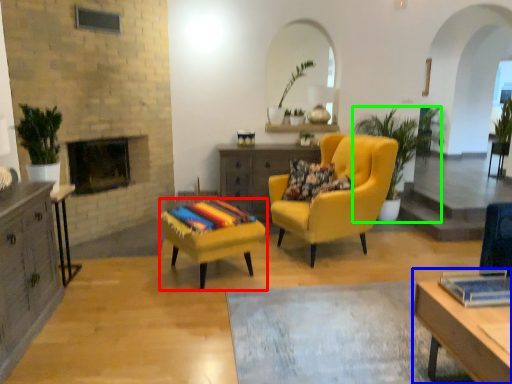
Question: Estimate the real-world distances between objects in this image. Which object is farther from stool (highlighted by a red box), desk (highlighted by a blue box) or houseplant (highlighted by a green box)?

Choices:
 (A) desk
 (B) houseplant

Answer: (B)